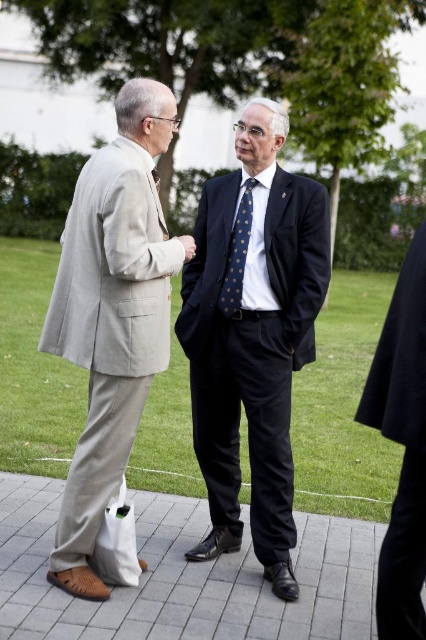
You are standing in front of the two men in the image. Which man is wearing the polished dark blue suit at center?

The man on the right is wearing the polished dark blue suit at center.

Looking at this image, you are a photographer trying to capture a candid shot of the two men in the scene. Since the light beige fabric suit at left and the blue dotted tie at center are in your viewfinder, which one is closer to the camera based on their positions?

The light beige fabric suit at left is positioned under the blue dotted tie at center, meaning the blue dotted tie at center is closer to the camera.